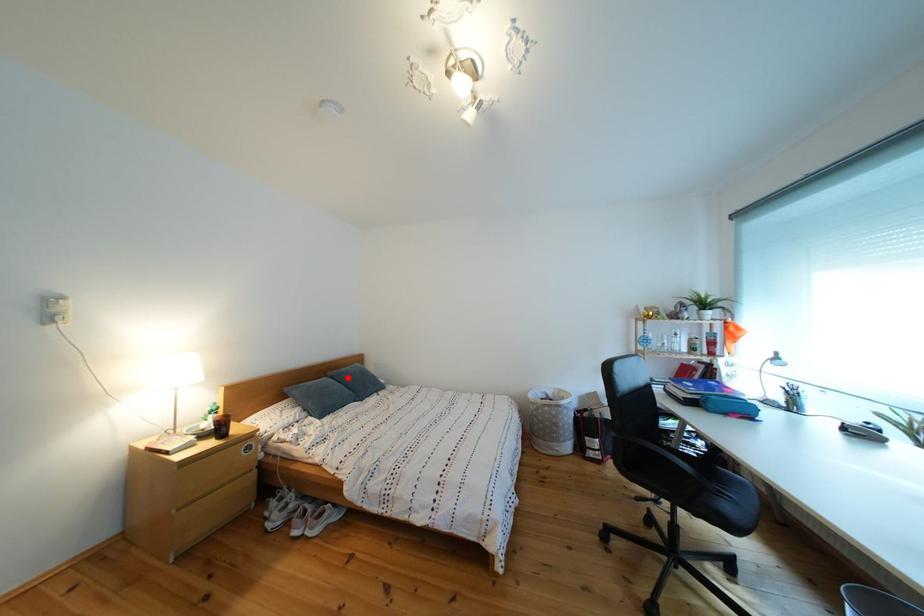
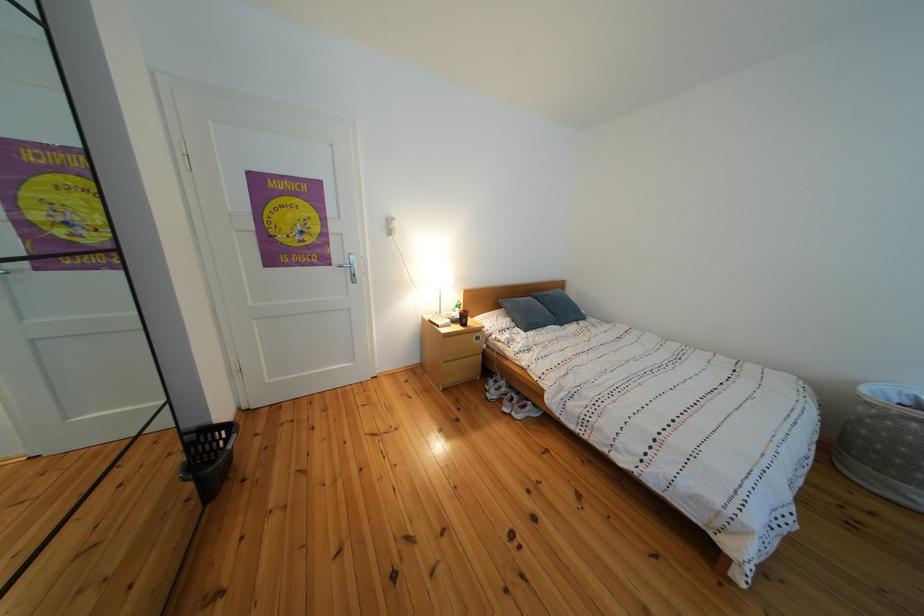
The point at the highlighted location is marked in the first image. Where is the corresponding point in the second image?

(552, 300)